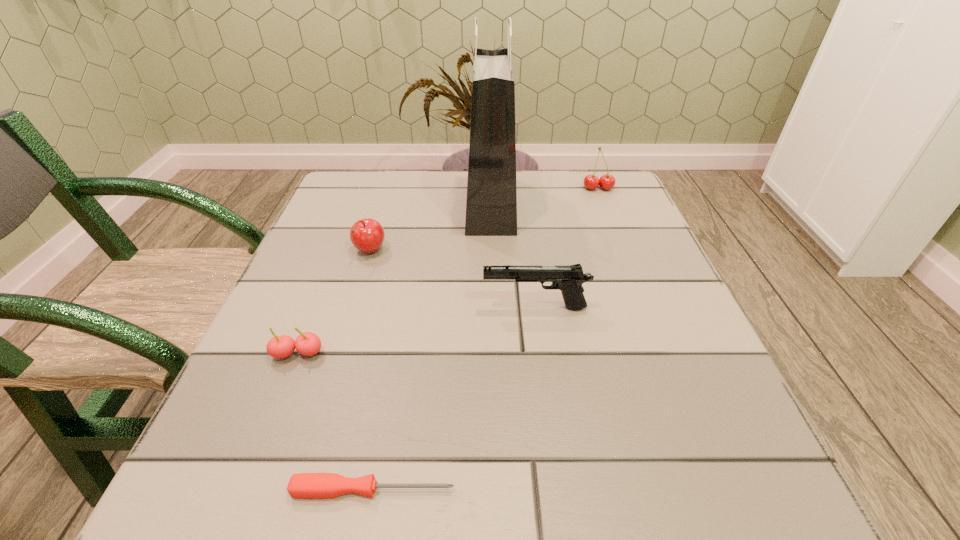
In order to click on free location located 0.290m on the front with handles of the shopping bag in this screenshot , I will do `click(347, 204)`.

What are the coordinates of `vacant space located 0.150m on the front with handles of the shopping bag` in the screenshot? It's located at (404, 204).

Image resolution: width=960 pixels, height=540 pixels. Find the location of `vacant area situated on the front with handles of the shopping bag`. vacant area situated on the front with handles of the shopping bag is located at coordinates (380, 204).

At what (x,y) coordinates should I click in order to perform the action: click on vacant space located 0.170m with the stems of the rightmost object pointing upwards. Please return your answer as a coordinate pair (x, y). The width and height of the screenshot is (960, 540). Looking at the image, I should click on (615, 232).

Where is `free space located 0.080m at the aiming end of the fourth farthest object`? free space located 0.080m at the aiming end of the fourth farthest object is located at coordinates (439, 308).

Where is `vacant space situated at the aiming end of the fourth farthest object`? The width and height of the screenshot is (960, 540). vacant space situated at the aiming end of the fourth farthest object is located at coordinates (412, 308).

Identify the location of free region located 0.150m at the aiming end of the fourth farthest object. (400, 308).

Locate an element on the screen. The image size is (960, 540). vacant region located on the right of the second shortest cherry is located at coordinates (481, 252).

Locate an element on the screen. free spot located on the back of the fifth tallest object is located at coordinates (317, 305).

This screenshot has width=960, height=540. What are the coordinates of `vacant space located 0.280m at the tip of the nearest object` in the screenshot? It's located at (675, 490).